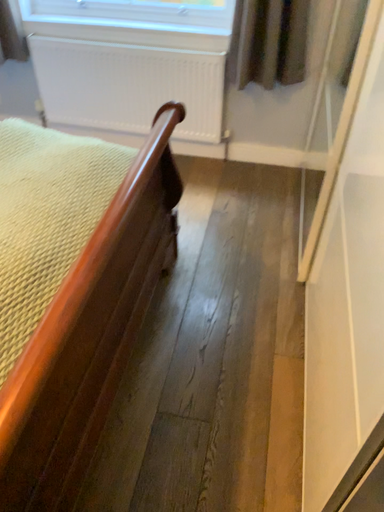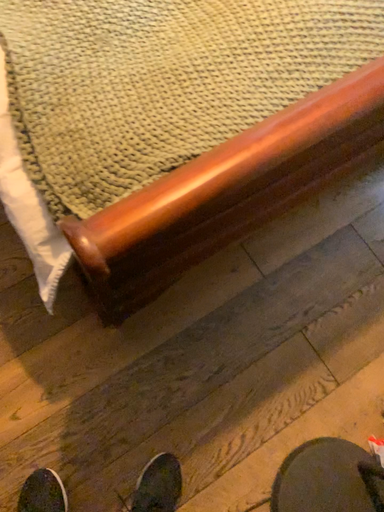
Question: Which way did the camera rotate in the video?

Choices:
 (A) rotated left
 (B) rotated right

Answer: (A)